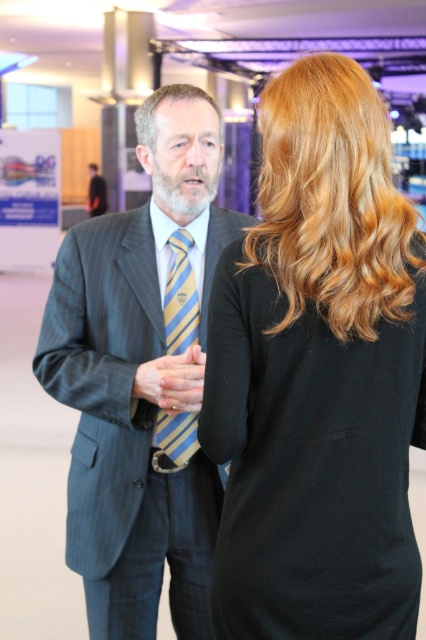
You are organizing a photo shoot and need to ensure that the pinstriped suit at center and the yellow striped tie at center are positioned in a way that the tie doesn not block the suit. Based on their sizes, which item should be placed closer to the camera to achieve this?

The pinstriped suit at center is wider than the yellow striped tie at center, so placing the yellow striped tie at center closer to the camera would prevent it from blocking the wider pinstriped suit at center.

You are at a formal event and need to greet both the person in the smooth black dress at center and the person in the pinstriped suit at center. Which one should you approach first if you want to start with the person on the left?

The pinstriped suit at center is on the left side of the smooth black dress at center, so you should approach the person in the pinstriped suit at center first.

You are at a formal event and want to approach the person wearing the pinstriped suit at center and the matte black suit at center. Which one can you reach first if you walk straight ahead?

The pinstriped suit at center is closer to the viewer than the matte black suit at center, so you can reach the person wearing the pinstriped suit at center first.